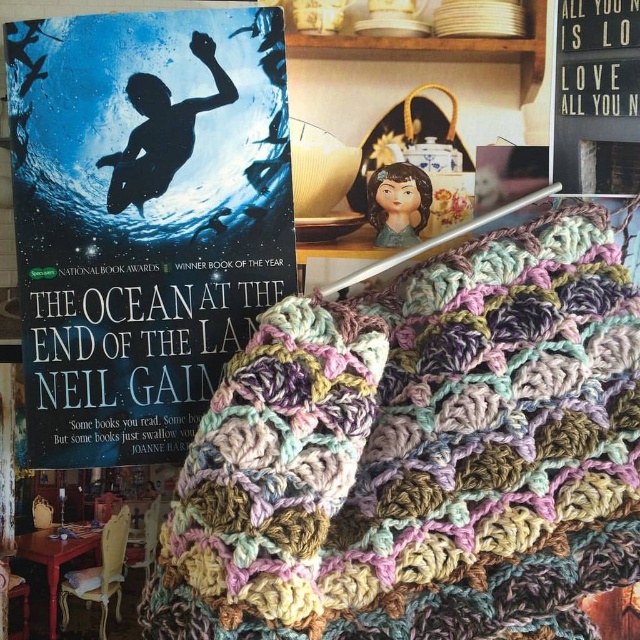
Question: Is multicolored crocheted blanket at center above matte paper book at left?

Choices:
 (A) yes
 (B) no

Answer: (B)

Question: Does multicolored crocheted blanket at center have a lesser width compared to matte paper book at left?

Choices:
 (A) no
 (B) yes

Answer: (A)

Question: Is multicolored crocheted blanket at center smaller than matte paper book at left?

Choices:
 (A) no
 (B) yes

Answer: (A)

Question: Based on their relative distances, which object is farther from the matte paper book at left?

Choices:
 (A) wooden signboard at upper right
 (B) multicolored crocheted blanket at center

Answer: (A)

Question: Which point is farther to the camera?

Choices:
 (A) matte paper book at left
 (B) multicolored crocheted blanket at center

Answer: (A)

Question: Considering the real-world distances, which object is closest to the wooden signboard at upper right?

Choices:
 (A) multicolored crocheted blanket at center
 (B) matte paper book at left

Answer: (A)